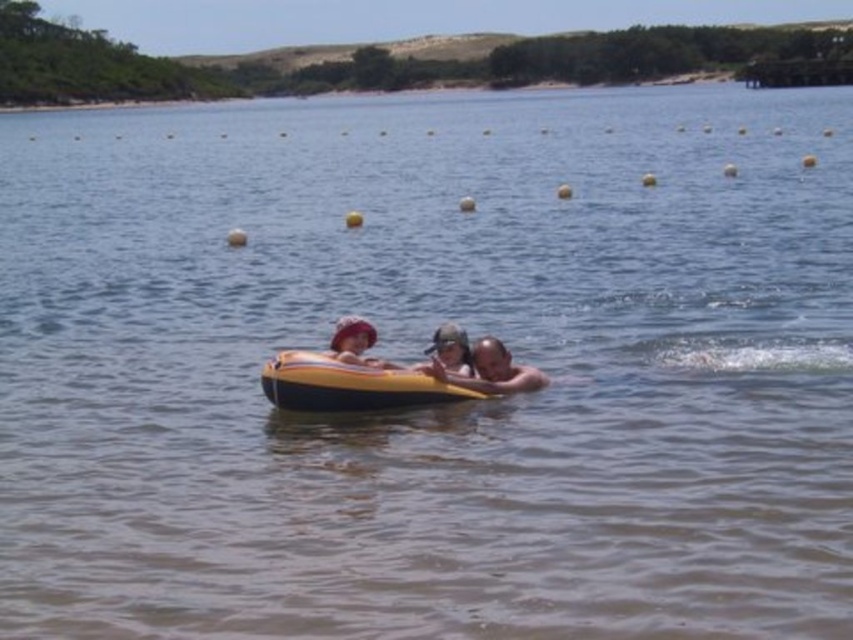
Based on the photo, you are standing on the lakeside and want to call out to the smooth skin man at center. Considering that a normal human voice can carry up to 20 meters, will your voice reach him?

The smooth skin man at center is 22.76 meters away from the viewer. Since the maximum distance a normal human voice can carry is 20 meters, the voice will not reach him.

You are standing on the lakeside and want to take a photo of the yellow rubber boat at center and the smooth skin man at center. Which one will appear closer to you in the photo?

The yellow rubber boat at center will appear closer to you in the photo because it is positioned in front of the smooth skin man at center.